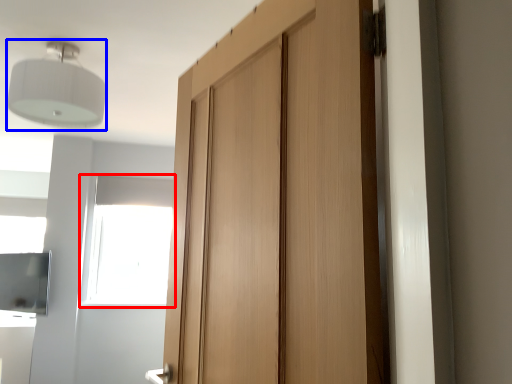
Question: Which object is further to the camera taking this photo, window (highlighted by a red box) or light fixture (highlighted by a blue box)?

Choices:
 (A) window
 (B) light fixture

Answer: (A)